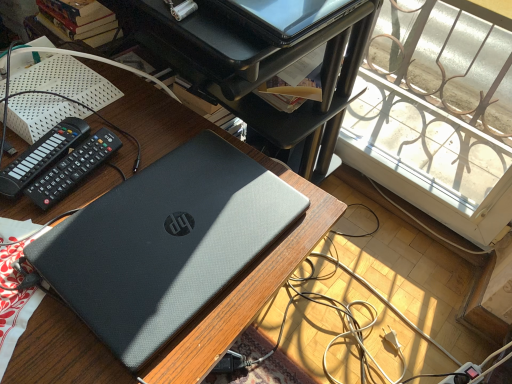
This screenshot has height=384, width=512. Identify the location of unoccupied region to the right of black plastic remote at upper left, which is counted as the 1th control, starting from the right. (160, 164).